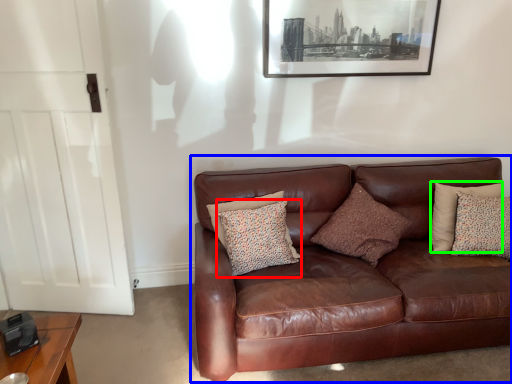
Question: Which object is the farthest from pillow (highlighted by a red box)? Choose among these: studio couch (highlighted by a blue box) or pillow (highlighted by a green box).

Choices:
 (A) studio couch
 (B) pillow

Answer: (B)